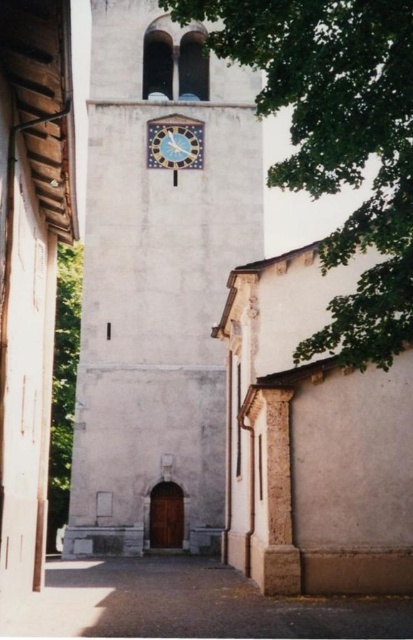
You are standing in front of a church and looking at the white stone clock tower at center and the green leafy tree at upper center. Which object is positioned to the left of the other?

The white stone clock tower at center is to the left of green leafy tree at upper center.